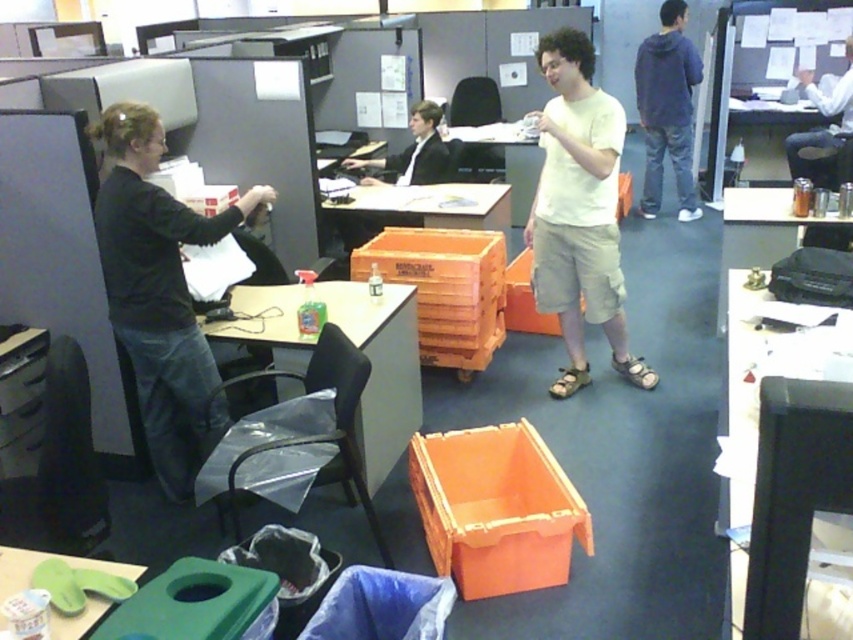
Based on the photo, is translucent plastic table at center positioned before blue hoodie at upper right?

That is True.

Is translucent plastic table at center below blue hoodie at upper right?

Correct, translucent plastic table at center is located below blue hoodie at upper right.

At what (x,y) coordinates should I click in order to perform the action: click on translucent plastic table at center. Please return your answer as a coordinate pair (x, y). The height and width of the screenshot is (640, 853). Looking at the image, I should click on (381, 368).

Who is higher up, white cotton t-shirt at center or orange plastic crate at center?

orange plastic crate at center is above.

This screenshot has height=640, width=853. What are the coordinates of `white cotton t-shirt at center` in the screenshot? It's located at (579, 211).

Between black matte shirt at upper left and orange plastic crate at center, which one appears on the left side from the viewer's perspective?

Positioned to the left is black matte shirt at upper left.

Between black matte shirt at upper left and orange plastic crate at center, which one is positioned lower?

black matte shirt at upper left is lower down.

Is point (135, 145) behind point (456, 196)?

That is False.

Locate an element on the screen. This screenshot has height=640, width=853. black matte shirt at upper left is located at coordinates (160, 292).